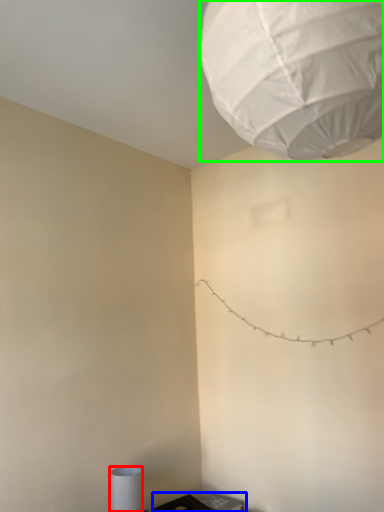
Question: Estimate the real-world distances between objects in this image. Which object is closer to lamp (highlighted by a red box), furniture (highlighted by a blue box) or lantern (highlighted by a green box)?

Choices:
 (A) furniture
 (B) lantern

Answer: (A)